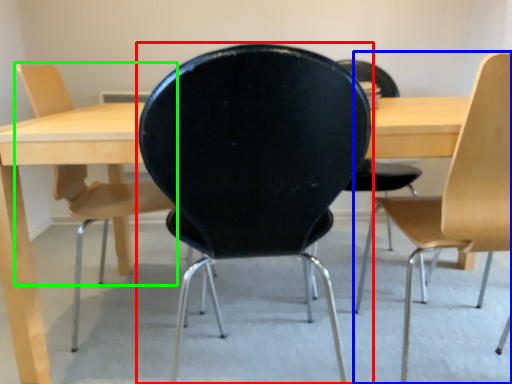
Question: Based on their relative distances, which object is nearer to chair (highlighted by a red box)? Choose from chair (highlighted by a blue box) and chair (highlighted by a green box).

Choices:
 (A) chair
 (B) chair

Answer: (A)